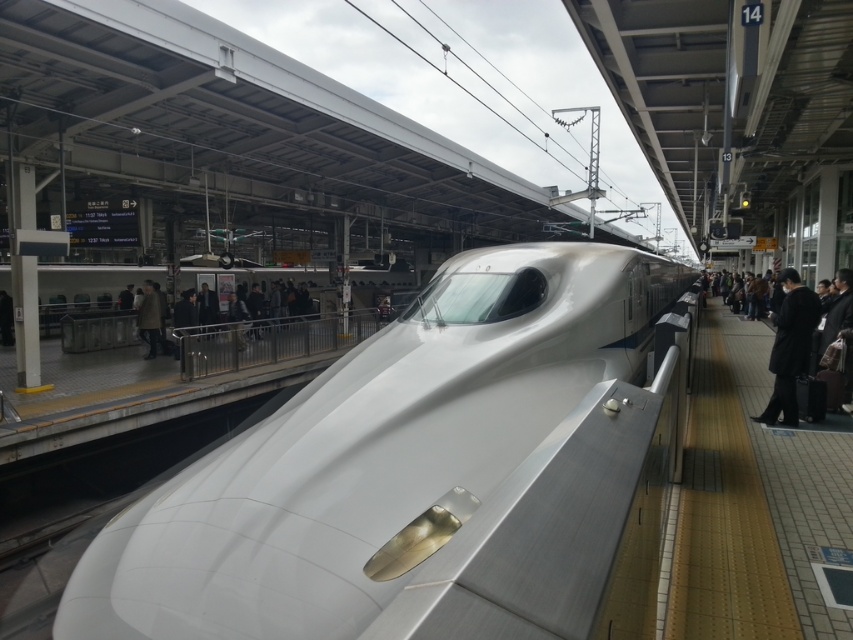
Question: Can you confirm if wooden platform at right is bigger than dark gray suit at right?

Choices:
 (A) no
 (B) yes

Answer: (A)

Question: Does white glossy bullet train at center have a greater width compared to wooden platform at right?

Choices:
 (A) no
 (B) yes

Answer: (B)

Question: Which is farther from the wooden platform at right?

Choices:
 (A) black wool coat at right
 (B) brown wool coat at center

Answer: (B)

Question: Which object appears closest to the camera in this image?

Choices:
 (A) wooden platform at right
 (B) black wool coat at right
 (C) dark gray suit at right

Answer: (A)

Question: Based on their relative distances, which object is farther from the wooden platform at right?

Choices:
 (A) white glossy bullet train at center
 (B) brown wool coat at center
 (C) dark gray suit at right
 (D) black wool coat at right

Answer: (B)

Question: From the image, what is the correct spatial relationship of dark gray suit at right in relation to brown wool coat at center?

Choices:
 (A) left
 (B) right

Answer: (B)